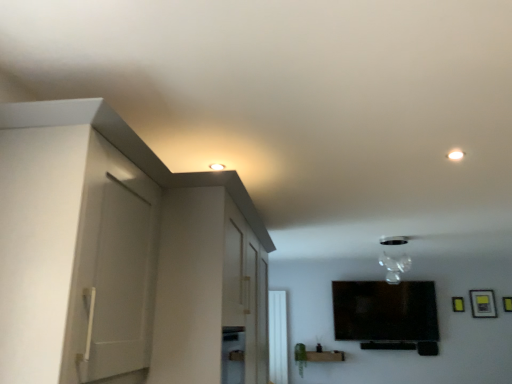
Question: Does white matte cabinet at left lie behind white glossy window at center?

Choices:
 (A) no
 (B) yes

Answer: (A)

Question: Does white matte cabinet at left have a greater width compared to white glossy window at center?

Choices:
 (A) no
 (B) yes

Answer: (B)

Question: Is white matte cabinet at left taller than white glossy window at center?

Choices:
 (A) no
 (B) yes

Answer: (A)

Question: Can you confirm if white matte cabinet at left is thinner than white glossy window at center?

Choices:
 (A) no
 (B) yes

Answer: (A)

Question: Is white glossy window at center at the back of white matte cabinet at left?

Choices:
 (A) no
 (B) yes

Answer: (A)

Question: Would you say white matte cabinet at left is outside white glossy window at center?

Choices:
 (A) no
 (B) yes

Answer: (B)

Question: Does transparent glass vase at upper center contain yellow matte picture frame at upper right, which appears as the first picture frame when viewed from the left?

Choices:
 (A) no
 (B) yes

Answer: (A)

Question: Can you confirm if transparent glass vase at upper center is bigger than yellow matte picture frame at upper right, which is the second picture frame from right to left?

Choices:
 (A) yes
 (B) no

Answer: (A)

Question: Considering the relative sizes of transparent glass vase at upper center and yellow matte picture frame at upper right, which appears as the first picture frame when viewed from the left, in the image provided, is transparent glass vase at upper center smaller than yellow matte picture frame at upper right, which appears as the first picture frame when viewed from the left,?

Choices:
 (A) no
 (B) yes

Answer: (A)

Question: Does transparent glass vase at upper center have a lesser height compared to yellow matte picture frame at upper right, which is the second picture frame from right to left?

Choices:
 (A) no
 (B) yes

Answer: (A)

Question: Is transparent glass vase at upper center further to camera compared to yellow matte picture frame at upper right, which appears as the first picture frame when viewed from the left?

Choices:
 (A) no
 (B) yes

Answer: (A)

Question: Is transparent glass vase at upper center turned away from yellow matte picture frame at upper right, which is the second picture frame from right to left?

Choices:
 (A) yes
 (B) no

Answer: (B)

Question: Is white matte cabinet at left at the back of white glossy window at center?

Choices:
 (A) no
 (B) yes

Answer: (A)